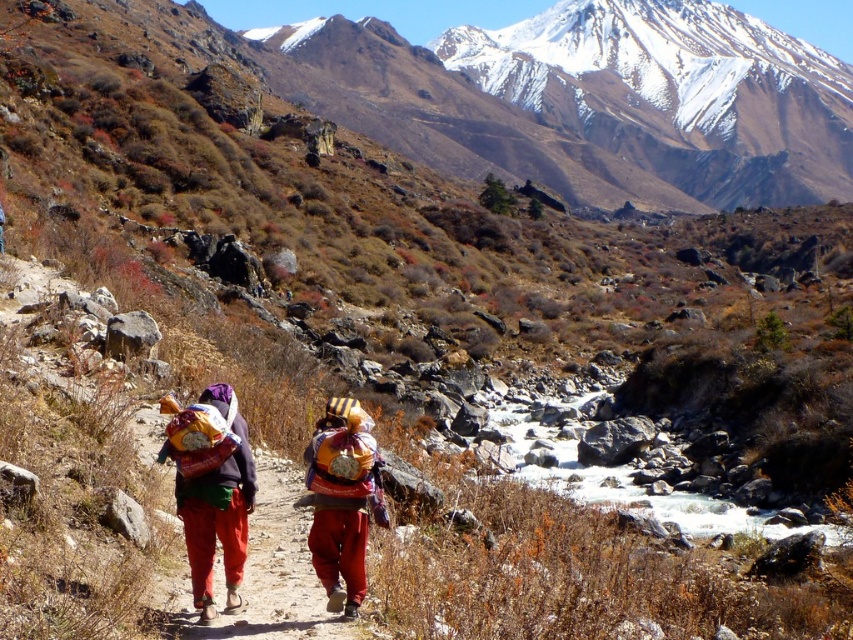
Based on the scene description, what is the 2D coordinate of the snowy rock mountain at upper center?

The snowy rock mountain at upper center is located at the 2D coordinate point of (614,93).